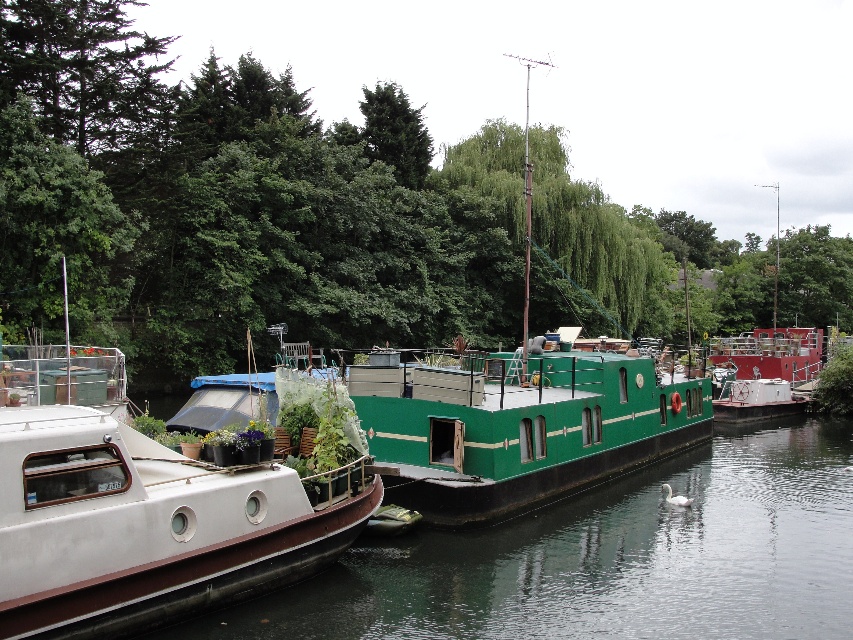
Question: Does green leafy tree at center have a smaller size compared to white matte boat at left?

Choices:
 (A) yes
 (B) no

Answer: (B)

Question: Which point appears farthest from the camera in this image?

Choices:
 (A) (247, 163)
 (B) (1, 576)

Answer: (A)

Question: Can you confirm if green leafy tree at center is thinner than white matte boat at left?

Choices:
 (A) no
 (B) yes

Answer: (A)

Question: Which object appears farthest from the camera in this image?

Choices:
 (A) green leafy tree at center
 (B) white matte boat at left

Answer: (A)

Question: Does green leafy tree at center appear on the left side of white matte boat at left?

Choices:
 (A) no
 (B) yes

Answer: (A)